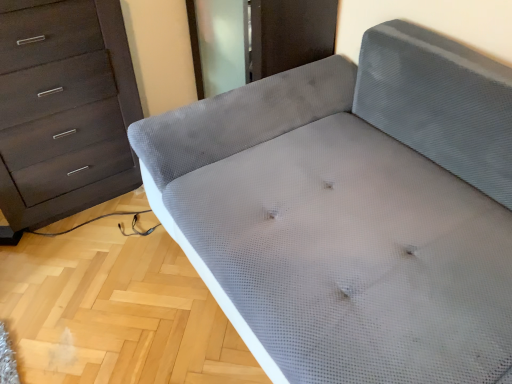
Question: Visually, is matte dark brown chest of drawers at left positioned to the left or to the right of gray fabric couch at center?

Choices:
 (A) right
 (B) left

Answer: (B)

Question: Do you think matte dark brown chest of drawers at left is within gray fabric couch at center, or outside of it?

Choices:
 (A) inside
 (B) outside

Answer: (B)

Question: Is matte dark brown chest of drawers at left bigger or smaller than gray fabric couch at center?

Choices:
 (A) small
 (B) big

Answer: (A)

Question: Considering their positions, is gray fabric couch at center located in front of or behind matte dark brown chest of drawers at left?

Choices:
 (A) front
 (B) behind

Answer: (A)

Question: From the image's perspective, is gray fabric couch at center positioned above or below matte dark brown chest of drawers at left?

Choices:
 (A) below
 (B) above

Answer: (A)

Question: Based on their positions, is gray fabric couch at center located to the left or right of matte dark brown chest of drawers at left?

Choices:
 (A) left
 (B) right

Answer: (B)

Question: Is gray fabric couch at center taller or shorter than matte dark brown chest of drawers at left?

Choices:
 (A) tall
 (B) short

Answer: (B)